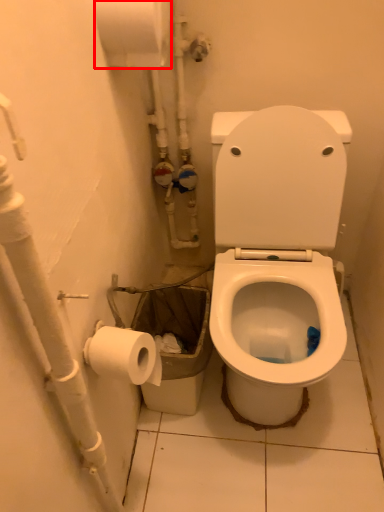
Question: Considering the relative positions of toilet paper (annotated by the red box) and water pipe in the image provided, where is toilet paper (annotated by the red box) located with respect to the staircase?

Choices:
 (A) left
 (B) right

Answer: (B)